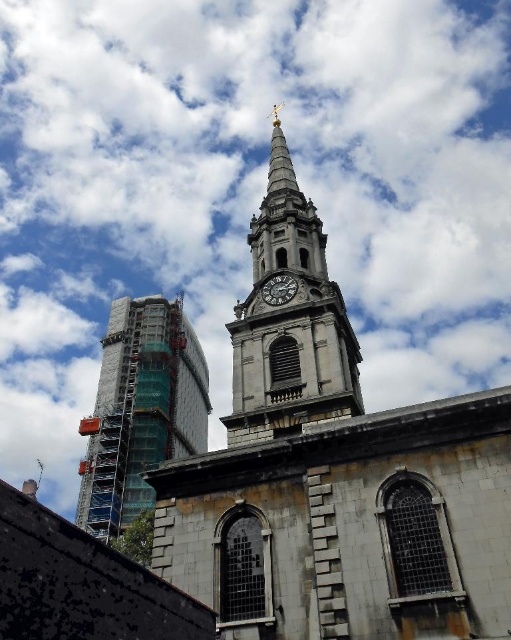
Question: Is stone clock tower at center to the right of scaffolding glass at left from the viewer's perspective?

Choices:
 (A) yes
 (B) no

Answer: (A)

Question: From the image, what is the correct spatial relationship of stone clock tower at center in relation to dark gray stone clock at center?

Choices:
 (A) left
 (B) right

Answer: (B)

Question: Is stone clock tower at center positioned behind scaffolding glass at left?

Choices:
 (A) no
 (B) yes

Answer: (A)

Question: Which of these objects is positioned closest to the stone clock tower at center?

Choices:
 (A) scaffolding glass at left
 (B) dark gray stone clock at center

Answer: (B)

Question: Estimate the real-world distances between objects in this image. Which object is farther from the stone clock tower at center?

Choices:
 (A) scaffolding glass at left
 (B) dark gray stone clock at center

Answer: (A)

Question: Which object is the closest to the dark gray stone clock at center?

Choices:
 (A) stone clock tower at center
 (B) scaffolding glass at left

Answer: (A)